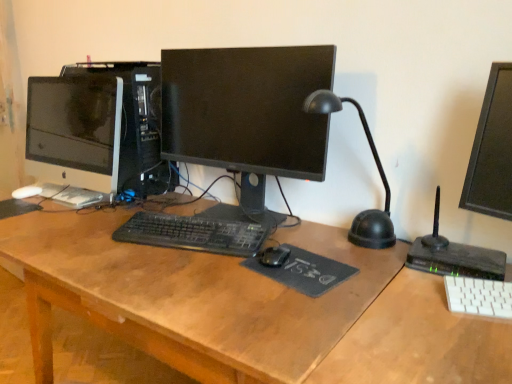
Locate an element on the screen. empty space that is to the right of black fabric mousepad at center, placed as the 2th mousepad when sorted from left to right is located at coordinates (377, 267).